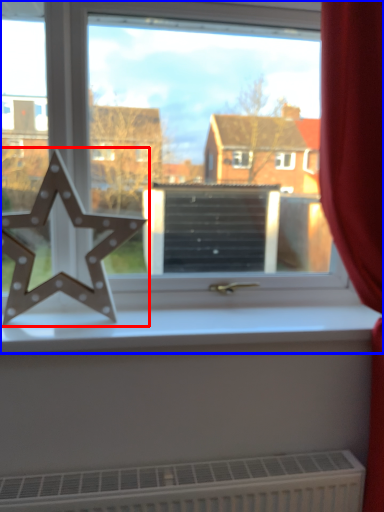
Question: Which object is further to the camera taking this photo, letter (highlighted by a red box) or window (highlighted by a blue box)?

Choices:
 (A) letter
 (B) window

Answer: (B)